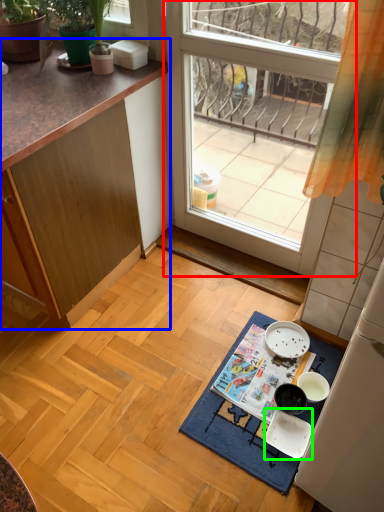
Question: Considering the real-world distances, which object is farthest from window (highlighted by a red box)? cabinetry (highlighted by a blue box) or tableware (highlighted by a green box)?

Choices:
 (A) cabinetry
 (B) tableware

Answer: (B)